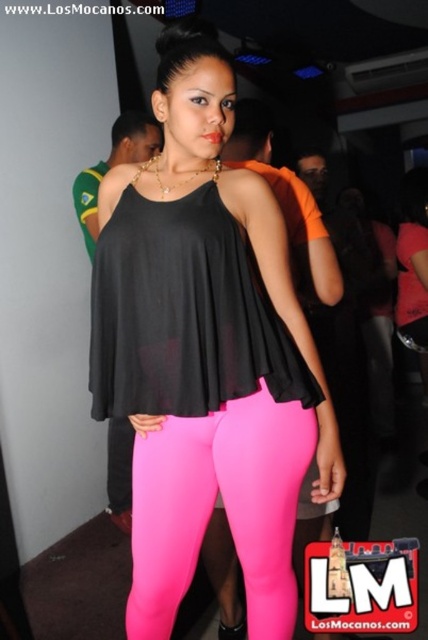
You are taking a photo of the scene and want to focus on both the point at coordinates point (288, 262) and point (244, 476). Since you can only focus on one point at a time, which point should you choose to ensure the other point is still in focus?

You should focus on point (288, 262) because it is closer to the camera, and the depth of field will likely include the farther point (244, 476) in acceptable focus.

You are a fashion designer analyzing this outfit. The matte black top at center and neon pink leggings at center are part of the same ensemble. Which piece of clothing is wider?

The matte black top at center is wider than the neon pink leggings at center.

You are a photographer adjusting your camera settings to focus on the matte black top at center and neon pink leggings at center. Which object should you focus on first to ensure both are in sharp focus?

The matte black top at center is closer to the viewer than the neon pink leggings at center, so focus on the matte black top at center first. This way, the depth of field will naturally cover the neon pink leggings at center as well.